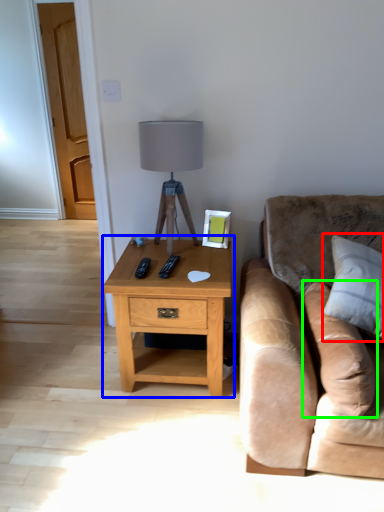
Question: Which object is the farthest from pillow (highlighted by a red box)? Choose among these: nightstand (highlighted by a blue box) or pillow (highlighted by a green box).

Choices:
 (A) nightstand
 (B) pillow

Answer: (A)